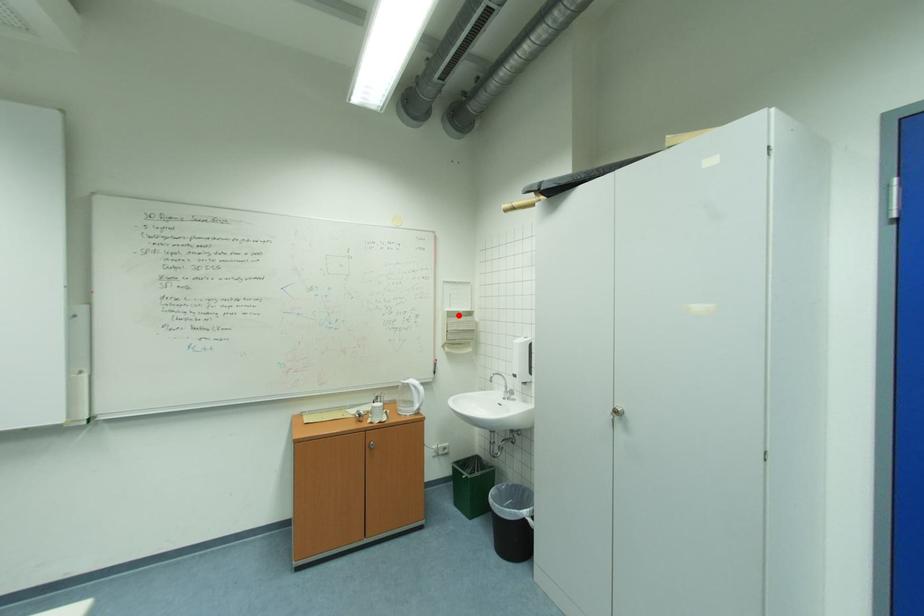
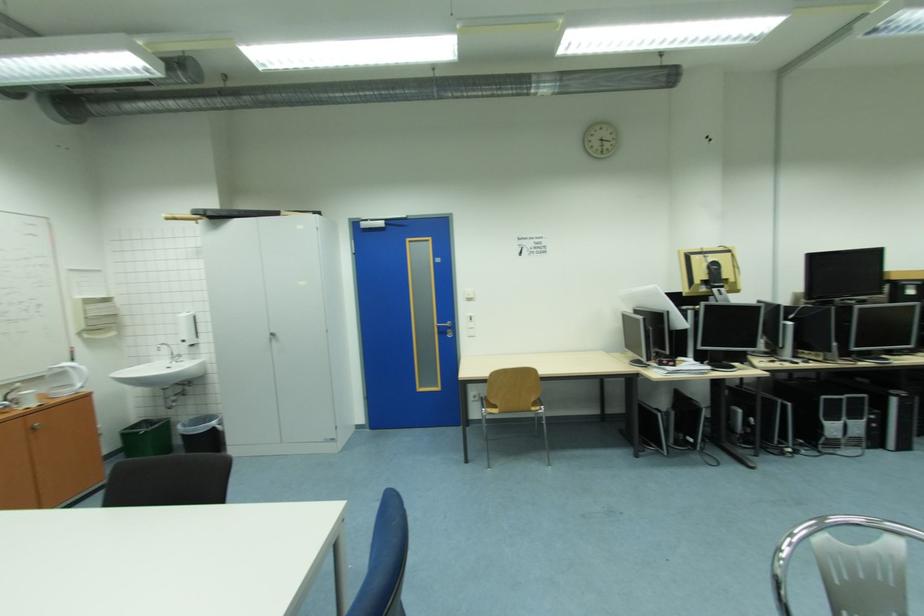
Where in the second image is the point corresponding to the highlighted location from the first image?

(94, 302)